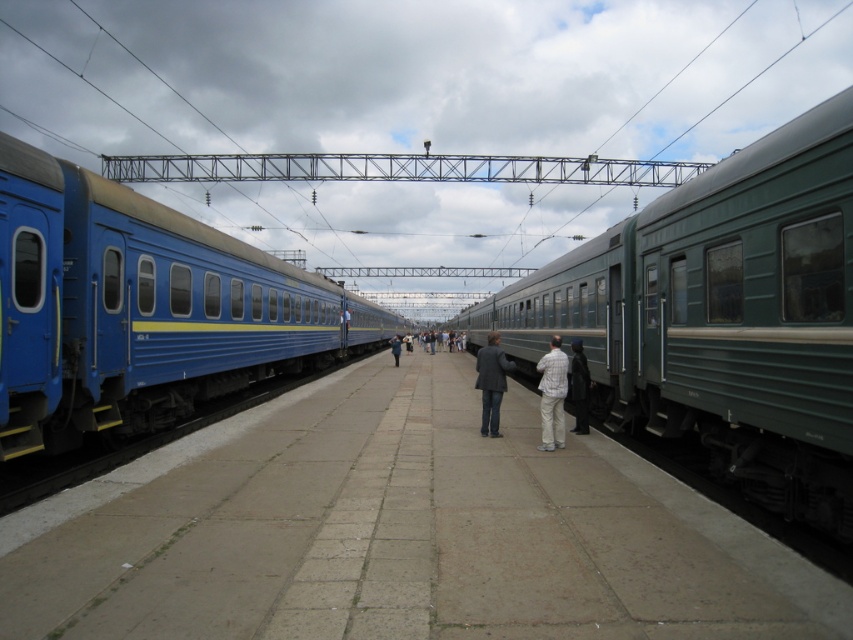
Looking at this image, is dark gray jacket at center thinner than blue fabric jacket at center?

Correct, dark gray jacket at center's width is less than blue fabric jacket at center's.

Does point (589, 378) come behind point (397, 358)?

No, (589, 378) is closer to viewer.

Which is behind, point (581, 358) or point (395, 358)?

The point (395, 358) is more distant.

Image resolution: width=853 pixels, height=640 pixels. I want to click on dark gray jacket at center, so click(x=579, y=387).

Can you confirm if concrete platform at center is thinner than blue fabric jacket at center?

In fact, concrete platform at center might be wider than blue fabric jacket at center.

Find the location of `concrete platform at center`. concrete platform at center is located at coordinates (398, 532).

Who is shorter, blue painted metal train car at left or dark gray jacket at center?

Standing shorter between the two is dark gray jacket at center.

Is blue painted metal train car at left wider than dark gray jacket at center?

Indeed, blue painted metal train car at left has a greater width compared to dark gray jacket at center.

Image resolution: width=853 pixels, height=640 pixels. In order to click on blue painted metal train car at left in this screenshot , I will do `click(141, 308)`.

Where is `blue painted metal train car at left`? The height and width of the screenshot is (640, 853). blue painted metal train car at left is located at coordinates (141, 308).